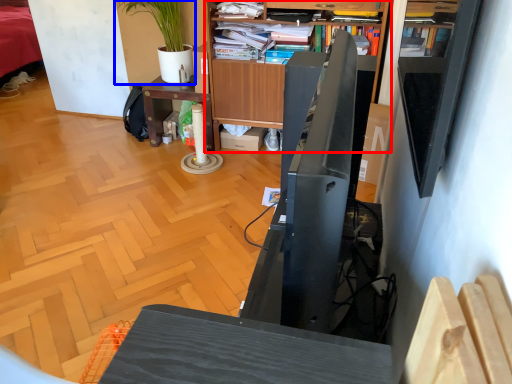
Question: Which object appears closest to the camera in this image, bookcase (highlighted by a red box) or houseplant (highlighted by a blue box)?

Choices:
 (A) bookcase
 (B) houseplant

Answer: (A)